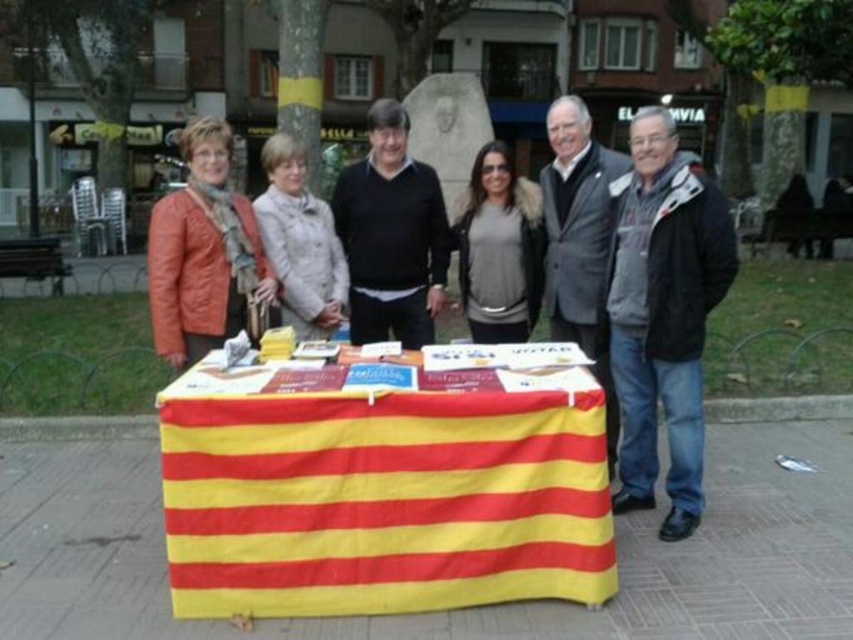
Question: Which of the following is the farthest from the observer?

Choices:
 (A) (241, 323)
 (B) (607, 403)
 (C) (267, 252)
 (D) (521, 305)

Answer: (D)

Question: In this image, where is orange leather jacket at left located relative to light beige fabric coat at center?

Choices:
 (A) right
 (B) left

Answer: (B)

Question: Which object appears closest to the camera in this image?

Choices:
 (A) orange leather jacket at left
 (B) gray woolen jacket at center
 (C) yellow/red striped cloth at center

Answer: (C)

Question: Which of the following is the closest to the observer?

Choices:
 (A) (572, 180)
 (B) (515, 513)

Answer: (B)

Question: Does orange leather jacket at left have a smaller size compared to light beige fabric coat at center?

Choices:
 (A) yes
 (B) no

Answer: (B)

Question: Does dark gray fleece jacket at right appear over gray matte jacket at center?

Choices:
 (A) yes
 (B) no

Answer: (A)